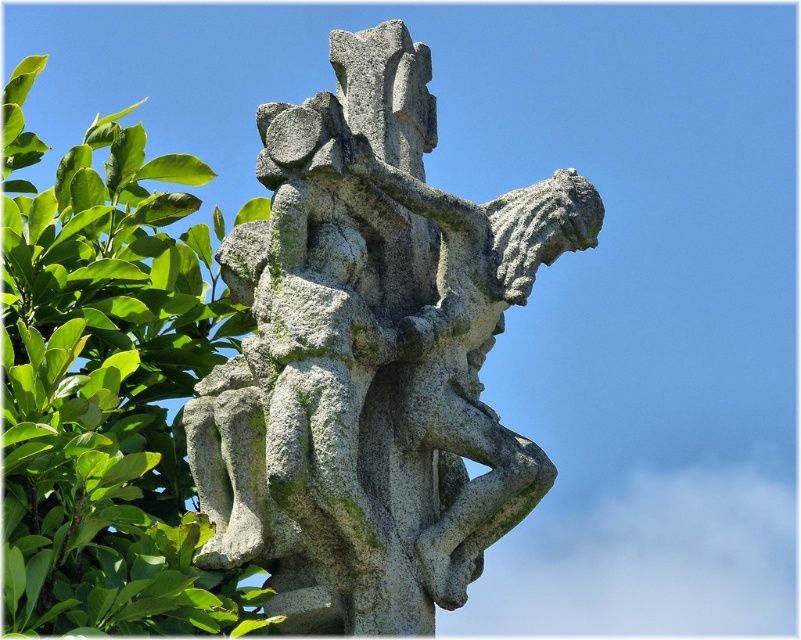
Question: Which point is farther to the camera?

Choices:
 (A) (379, 60)
 (B) (135, 513)

Answer: (A)

Question: Is gray stone sculpture at center below green leafy tree at upper left?

Choices:
 (A) no
 (B) yes

Answer: (A)

Question: Is gray stone sculpture at center to the right of green leafy tree at upper left from the viewer's perspective?

Choices:
 (A) yes
 (B) no

Answer: (A)

Question: Which point is farther to the camera?

Choices:
 (A) (47, 614)
 (B) (421, 454)

Answer: (B)

Question: Which of the following is the closest to the observer?

Choices:
 (A) (103, 369)
 (B) (592, 205)

Answer: (A)

Question: Is gray stone sculpture at center above green leafy tree at upper left?

Choices:
 (A) yes
 (B) no

Answer: (A)